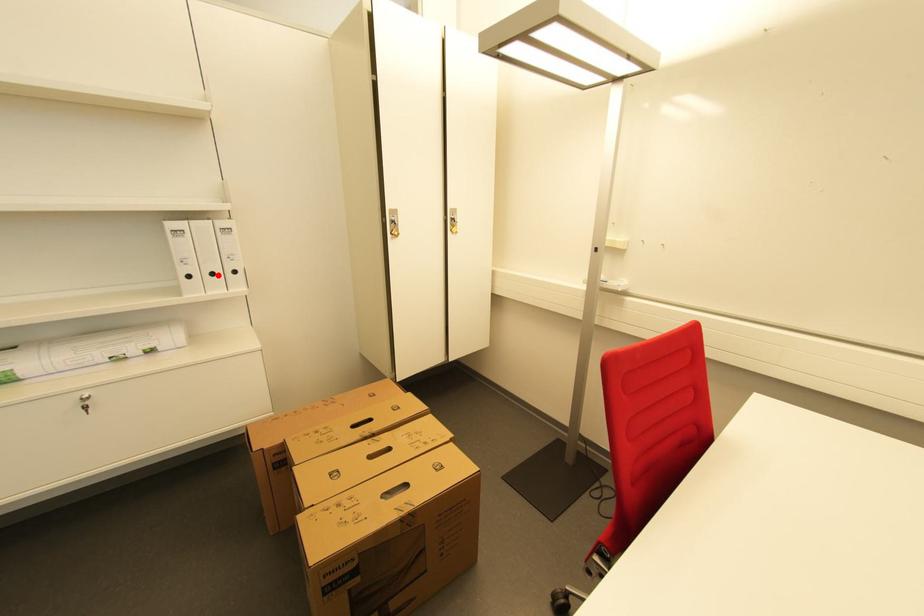
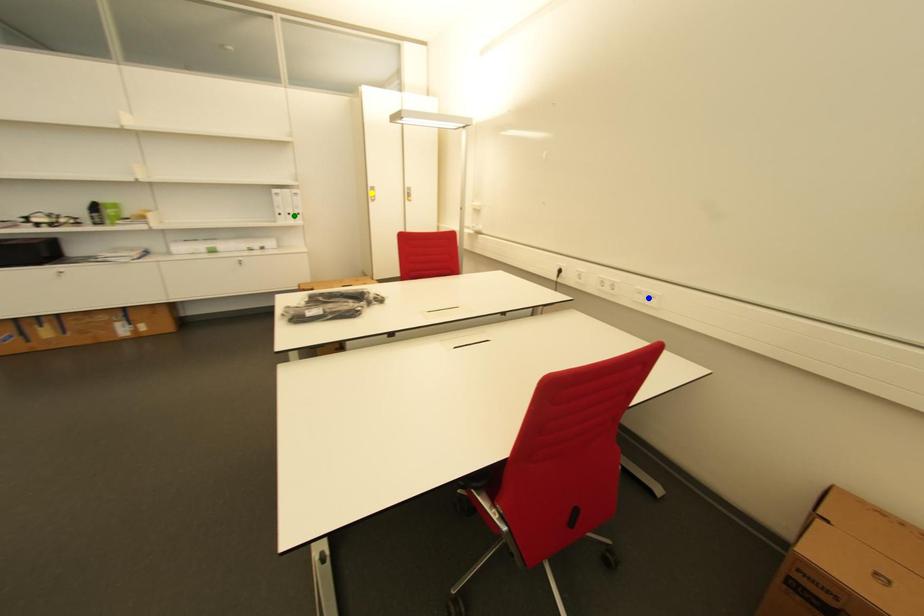
Question: I am providing you with two images of the same scene from different viewpoints. A red point is marked on the first image. You are given multiple points on the second image. Which point in image 2 is actually the same real-world point as the red point in image 1?

Choices:
 (A) yellow point
 (B) green point
 (C) blue point

Answer: (B)